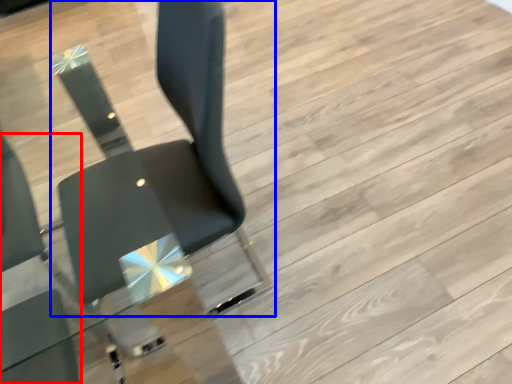
Question: Which point is further to the camera, chair (highlighted by a red box) or chair (highlighted by a blue box)?

Choices:
 (A) chair
 (B) chair

Answer: (A)